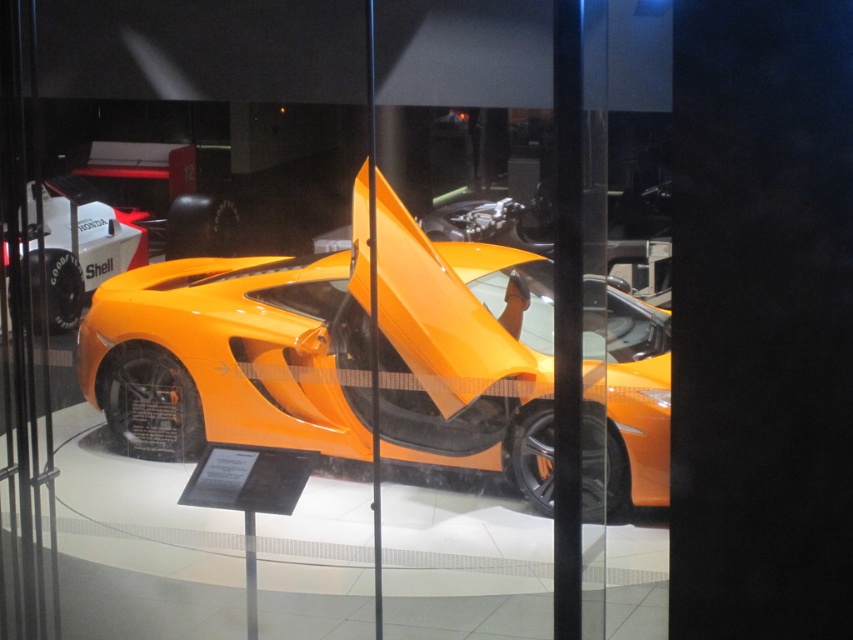
You are a visitor standing in front of the orange matte sports car at center and the orange matte concept car at left. Which car is positioned closer to you?

The orange matte sports car at center is closer to the viewer than the orange matte concept car at left.

You are a tour guide leading a group through the museum. You need to move a 3.0 meter long cart to place between the orange matte sports car at center and the orange matte concept car at left. Is there enough space between them to fit the cart?

The distance between the orange matte sports car at center and the orange matte concept car at left is 3.10 meters. Since the cart is 3.0 meters long, there is enough space to fit it between them with a small gap remaining.